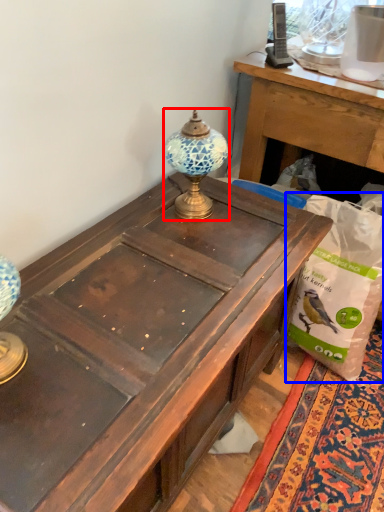
Question: Which object is closer to the camera taking this photo, lamp (highlighted by a red box) or paper bag (highlighted by a blue box)?

Choices:
 (A) lamp
 (B) paper bag

Answer: (A)